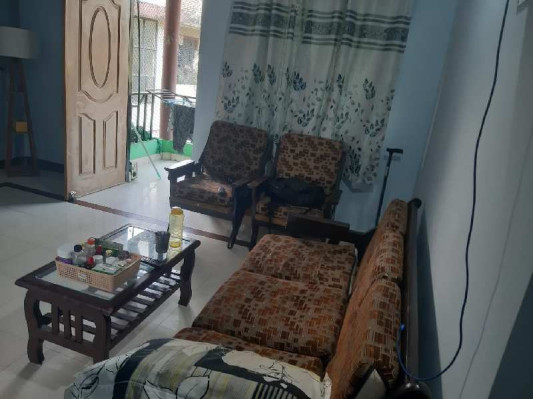
This screenshot has height=399, width=533. I want to click on green and white curtain, so click(311, 58).